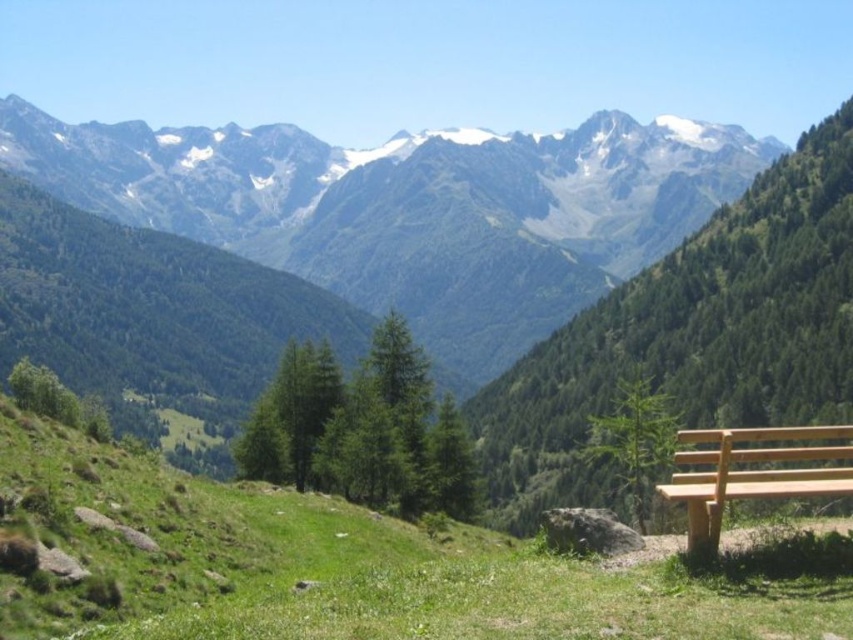
Can you confirm if green textured mountains at upper center is taller than green grassy at lower center?

Correct, green textured mountains at upper center is much taller as green grassy at lower center.

From the picture: Does green textured mountains at upper center appear over green grassy at lower center?

Correct, green textured mountains at upper center is located above green grassy at lower center.

Is point (280, 192) closer to viewer compared to point (410, 577)?

No, it is not.

At what (x,y) coordinates should I click in order to perform the action: click on green textured mountains at upper center. Please return your answer as a coordinate pair (x, y). Image resolution: width=853 pixels, height=640 pixels. Looking at the image, I should click on pos(412,209).

Does green grassy at lower center have a lesser height compared to light brown wood bench at lower right?

No.

Between green grassy at lower center and light brown wood bench at lower right, which one is positioned higher?

light brown wood bench at lower right is above.

Identify the location of green grassy at lower center. The width and height of the screenshot is (853, 640). (332, 566).

Identify the location of green grassy at lower center. (332, 566).

Is point (462, 182) positioned after point (703, 500)?

Yes, it is behind point (703, 500).

Between point (674, 148) and point (674, 458), which one is positioned behind?

The point (674, 148) is more distant.

In order to click on green textured mountains at upper center in this screenshot , I will do `click(412, 209)`.